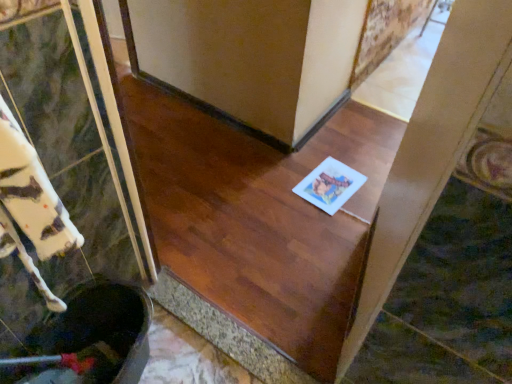
In order to click on free spot below white paper at center (from a real-world perspective) in this screenshot , I will do `click(330, 182)`.